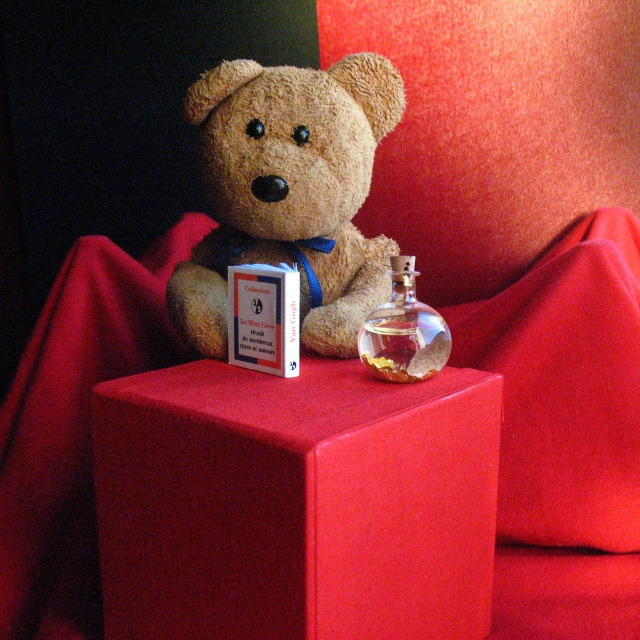
Question: Which object is the farthest from the matte red cube at center?

Choices:
 (A) soft plush teddy bear at center
 (B) velvet red cushion at upper center
 (C) transparent glass bottle at center

Answer: (B)

Question: Which of the following is the closest to the observer?

Choices:
 (A) transparent glass bottle at center
 (B) matte red cube at center
 (C) velvet red cushion at upper center
 (D) soft plush teddy bear at center

Answer: (B)

Question: Is velvet red cushion at upper center to the right of transparent glass bottle at center from the viewer's perspective?

Choices:
 (A) yes
 (B) no

Answer: (A)

Question: Does soft plush teddy bear at center appear over transparent glass bottle at center?

Choices:
 (A) no
 (B) yes

Answer: (B)

Question: Based on their relative distances, which object is nearer to the velvet red cushion at upper center?

Choices:
 (A) matte red cube at center
 (B) soft plush teddy bear at center

Answer: (A)

Question: Can you confirm if soft plush teddy bear at center is positioned below transparent glass bottle at center?

Choices:
 (A) no
 (B) yes

Answer: (A)